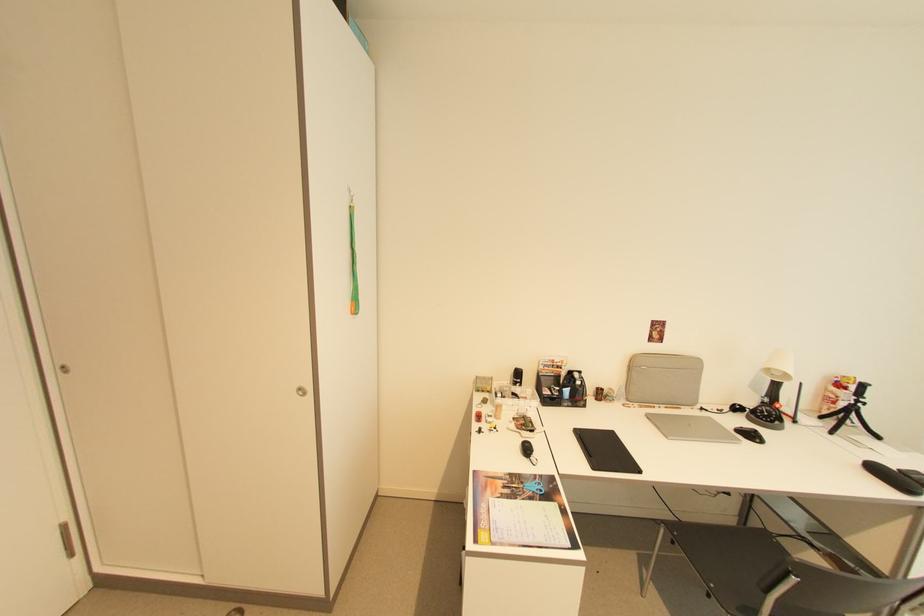
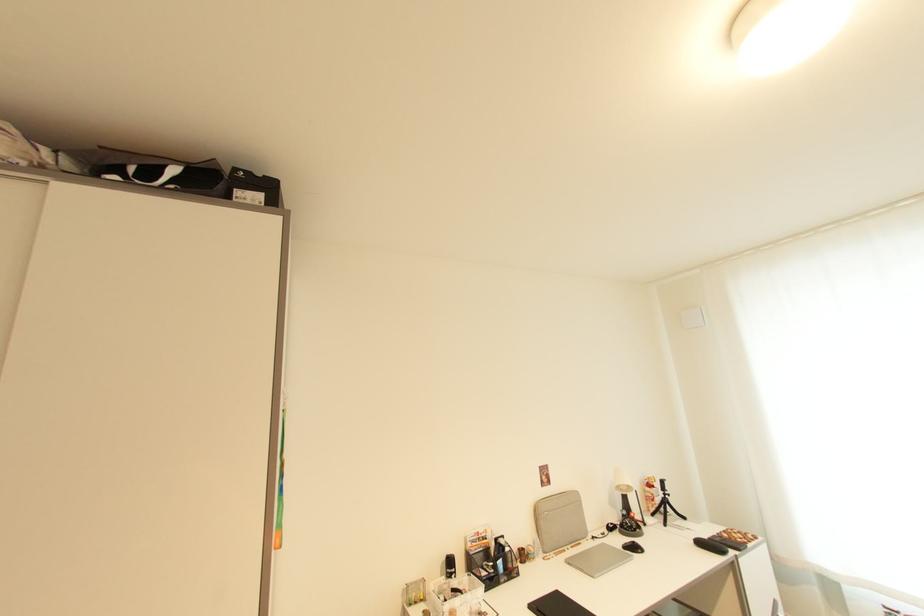
In the second image, find the point that corresponds to point 783,376 in the first image.

(629, 490)